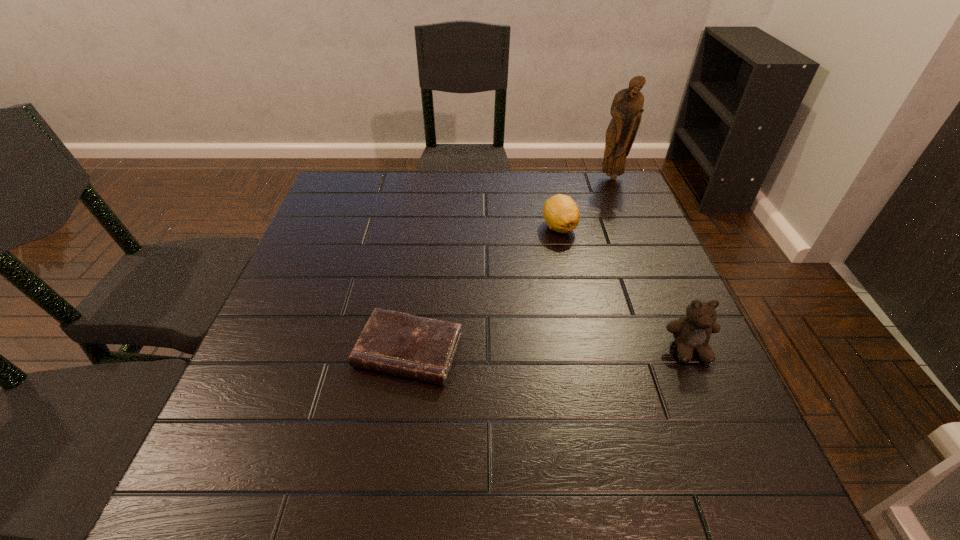
Where is `free region at the far edge of the desktop`? The height and width of the screenshot is (540, 960). free region at the far edge of the desktop is located at coordinates (457, 189).

Find the location of a particular element. free space at the left edge of the desktop is located at coordinates (309, 240).

Image resolution: width=960 pixels, height=540 pixels. I want to click on vacant space at the right edge of the desktop, so click(652, 254).

At what (x,y) coordinates should I click in order to perform the action: click on vacant space at the far left corner of the desktop. Please return your answer as a coordinate pair (x, y). Looking at the image, I should click on (374, 215).

This screenshot has width=960, height=540. In the image, there is a desktop. Find the location of `vacant space at the far right corner`. vacant space at the far right corner is located at coordinates [625, 179].

Where is `vacant region between the lemon and the teddy bear`? This screenshot has width=960, height=540. vacant region between the lemon and the teddy bear is located at coordinates (624, 288).

I want to click on empty space that is in between the second object from left to right and the farthest object, so click(x=586, y=202).

Identify the location of free space between the tallest object and the second shortest object. This screenshot has height=540, width=960. (586, 202).

Identify the location of free spot between the leftmost object and the farthest object. The image size is (960, 540). (511, 265).

Where is `free space between the third nearest object and the figurine`? This screenshot has height=540, width=960. free space between the third nearest object and the figurine is located at coordinates (586, 202).